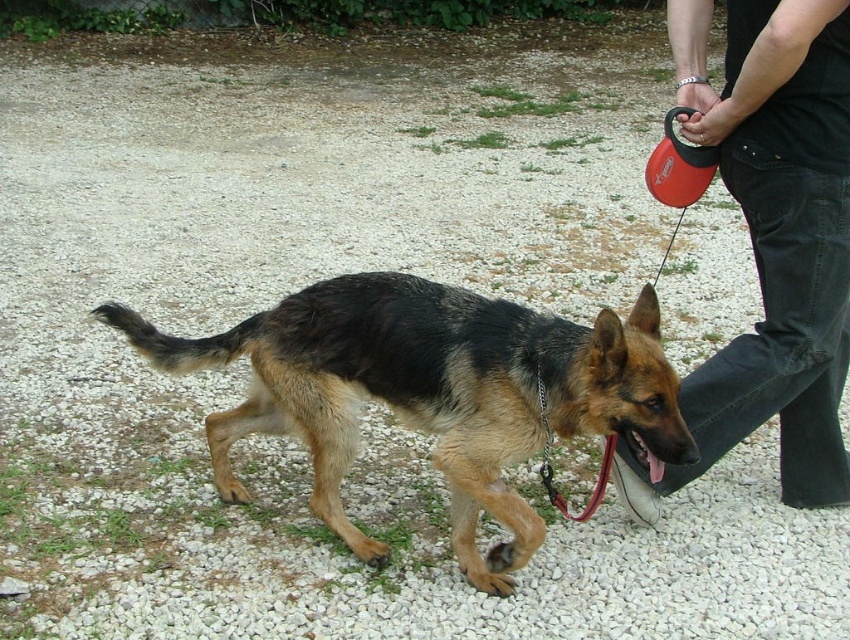
Question: Which object appears farthest from the camera in this image?

Choices:
 (A) dark blue jeans at right
 (B) black and tan fur dog at center

Answer: (A)

Question: Can you confirm if black and tan fur dog at center is bigger than dark blue jeans at right?

Choices:
 (A) no
 (B) yes

Answer: (B)

Question: Which object appears closest to the camera in this image?

Choices:
 (A) dark blue jeans at right
 (B) black and tan fur dog at center

Answer: (B)

Question: Does black and tan fur dog at center appear on the right side of dark blue jeans at right?

Choices:
 (A) no
 (B) yes

Answer: (A)

Question: Which object appears farthest from the camera in this image?

Choices:
 (A) black and tan fur dog at center
 (B) dark blue jeans at right

Answer: (B)

Question: Can you confirm if black and tan fur dog at center is positioned to the left of dark blue jeans at right?

Choices:
 (A) yes
 (B) no

Answer: (A)